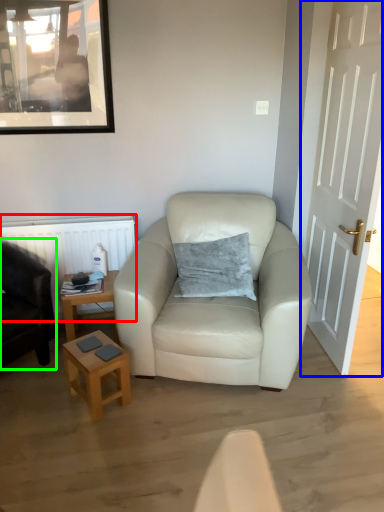
Question: Which object is the closest to the radiator (highlighted by a red box)? Choose among these: door (highlighted by a blue box) or chair (highlighted by a green box).

Choices:
 (A) door
 (B) chair

Answer: (B)